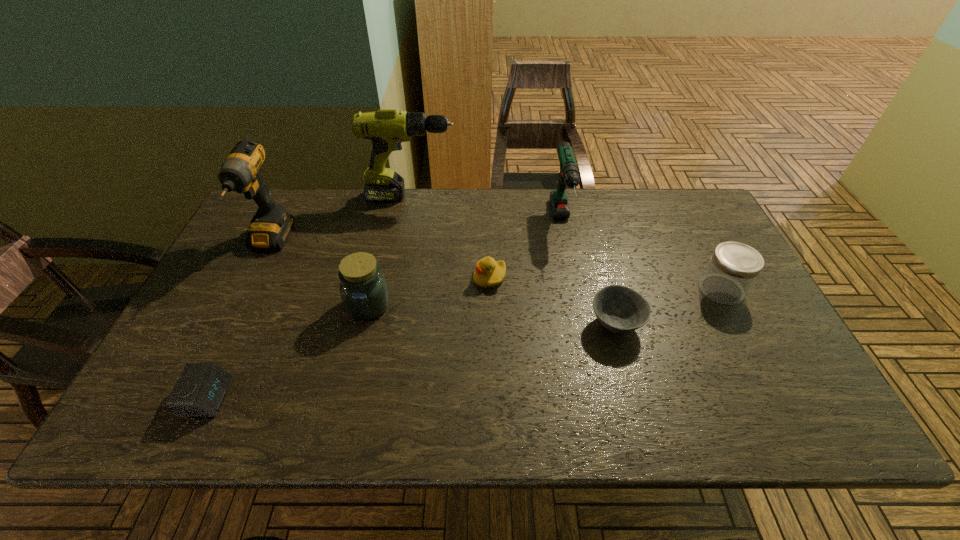
Choose which object is the fourth nearest neighbor to the fifth shortest object. Please provide its 2D coordinates. Your answer should be formatted as a tuple, i.e. [(x, y)], where the tuple contains the x and y coordinates of a point satisfying the conditions above.

[(387, 129)]

I want to click on the second closest object to the taller jar, so click(x=271, y=225).

Select which drill is the third closest to the fourth object from right to left. Please provide its 2D coordinates. Your answer should be formatted as a tuple, i.e. [(x, y)], where the tuple contains the x and y coordinates of a point satisfying the conditions above.

[(271, 225)]

The width and height of the screenshot is (960, 540). In order to click on the closest drill to the duckling in this screenshot , I will do `click(569, 173)`.

This screenshot has width=960, height=540. In order to click on free location that satisfies the following two spatial constraints: 1. with the drill bit of the leftmost drill facing forward; 2. on the left side of the fifth shortest object in this screenshot , I will do `click(239, 305)`.

Identify the location of blank space that satisfies the following two spatial constraints: 1. on the handle side of the fourth shortest object; 2. on the right side of the second drill from right to left. Image resolution: width=960 pixels, height=540 pixels. (395, 289).

This screenshot has width=960, height=540. I want to click on vacant point that satisfies the following two spatial constraints: 1. on the handle side of the third tallest object; 2. on the right side of the bowl, so click(x=582, y=325).

Locate an element on the screen. free space that satisfies the following two spatial constraints: 1. on the handle side of the bowl; 2. on the left side of the shortest drill is located at coordinates (582, 325).

At what (x,y) coordinates should I click in order to perform the action: click on free location that satisfies the following two spatial constraints: 1. on the back side of the fourth shortest object; 2. on the right side of the bowl. Please return your answer as a coordinate pair (x, y). Looking at the image, I should click on (606, 289).

Locate an element on the screen. This screenshot has width=960, height=540. blank area in the image that satisfies the following two spatial constraints: 1. on the front side of the right jar; 2. on the front-facing side of the alarm clock is located at coordinates (777, 397).